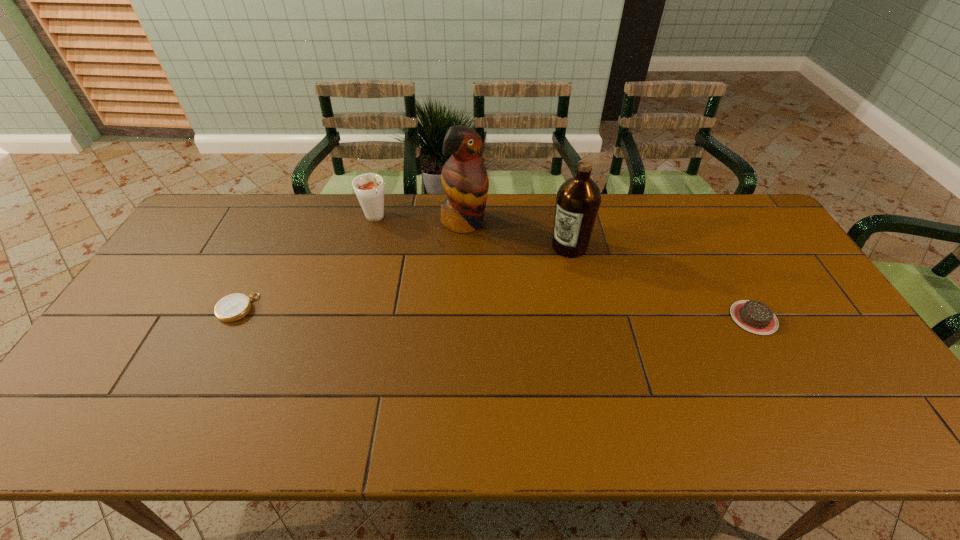
At what (x,y) coordinates should I click in order to perform the action: click on vacant spot on the desktop that is between the compass and the rightmost object and is positioned on the label of the second tallest object. Please return your answer as a coordinate pair (x, y). This screenshot has width=960, height=540. Looking at the image, I should click on (503, 313).

Locate an element on the screen. Image resolution: width=960 pixels, height=540 pixels. free space on the desktop that is between the leftmost object and the second shortest object and is positioned on the face of the third object from right to left is located at coordinates (546, 314).

Where is `vacant space on the desktop that is between the shortest object and the fourth tallest object and is positioned on the drink side of the third shortest object`? vacant space on the desktop that is between the shortest object and the fourth tallest object and is positioned on the drink side of the third shortest object is located at coordinates (435, 312).